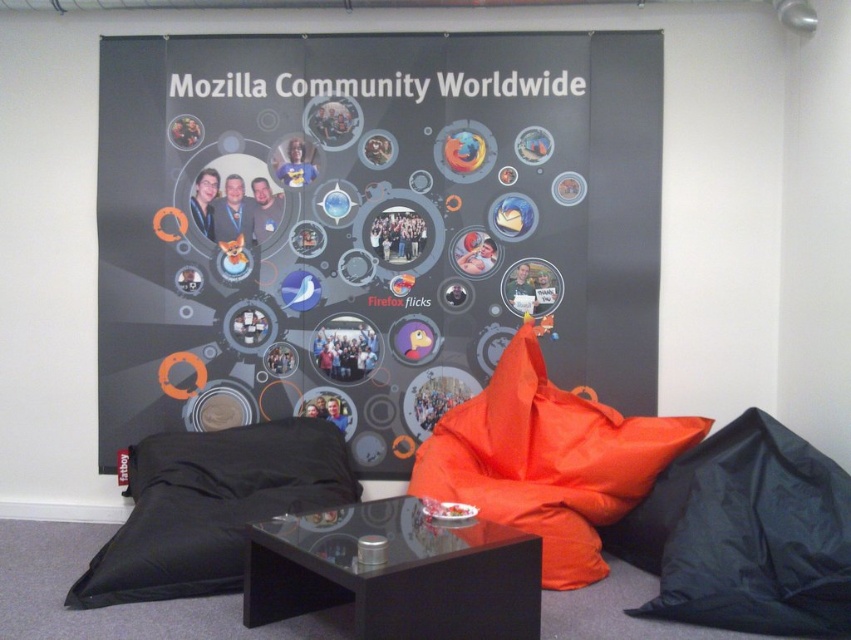
Does black fabric beanbag at lower right have a greater height compared to black fabric pillow at lower left?

Yes.

Which is above, black fabric beanbag at lower right or black fabric pillow at lower left?

black fabric pillow at lower left is higher up.

Is point (831, 561) more distant than point (230, 442)?

No, it is not.

Find the location of a particular element. black fabric beanbag at lower right is located at coordinates (745, 534).

Can you confirm if orange fabric bean bag at center is thinner than black fabric pillow at lower left?

No, orange fabric bean bag at center is not thinner than black fabric pillow at lower left.

The width and height of the screenshot is (851, 640). Find the location of `orange fabric bean bag at center`. orange fabric bean bag at center is located at coordinates (547, 460).

This screenshot has height=640, width=851. What are the coordinates of `orange fabric bean bag at center` in the screenshot? It's located at (547, 460).

Is point (163, 252) positioned in front of point (216, 577)?

No, it is not.

Which is in front, point (307, 225) or point (307, 432)?

Positioned in front is point (307, 432).

Is point (460, 360) positioned in front of point (166, 499)?

No, it is not.

Identify the location of matte black poster at center. The image size is (851, 640). (330, 227).